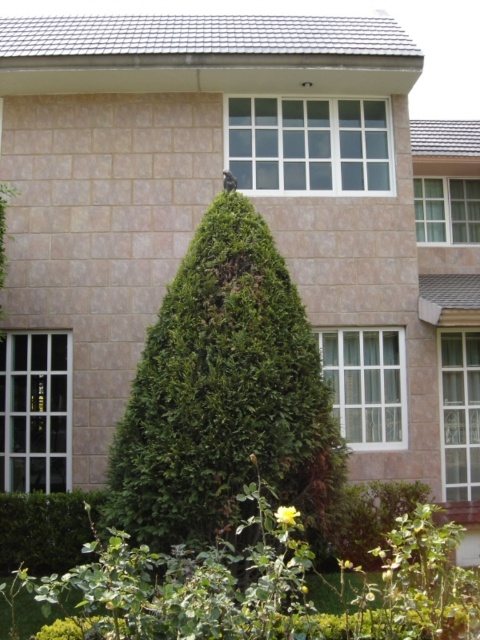
Question: Which of the following is the farthest from the observer?

Choices:
 (A) (92, 509)
 (B) (268, 269)

Answer: (A)

Question: Is green leafy tree at center positioned before clear glass window at center?

Choices:
 (A) yes
 (B) no

Answer: (A)

Question: Is clear glass window at left bigger than green leafy hedge at lower left?

Choices:
 (A) yes
 (B) no

Answer: (B)

Question: Considering the real-world distances, which object is farthest from the white glass window at center?

Choices:
 (A) green leafy hedge at lower left
 (B) green leafy tree at center
 (C) clear glass window at left
 (D) clear glass window at center

Answer: (B)

Question: Estimate the real-world distances between objects in this image. Which object is closer to the green leafy tree at center?

Choices:
 (A) green leafy hedge at lower left
 (B) clear glass window at left
 (C) clear glass window at center
 (D) white glass window at center

Answer: (A)

Question: Can you confirm if clear glass window at center is smaller than green leafy hedge at lower left?

Choices:
 (A) no
 (B) yes

Answer: (B)